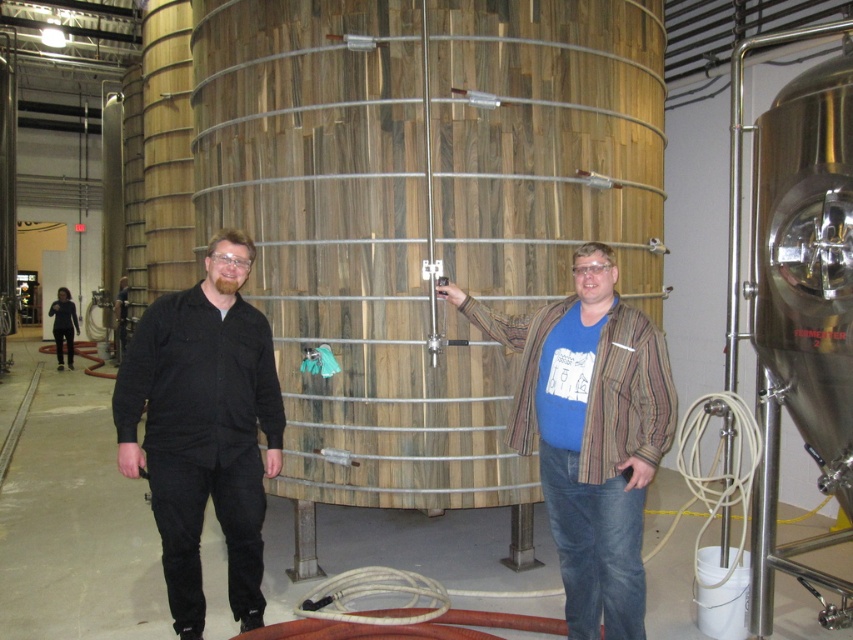
Question: From the image, what is the correct spatial relationship of striped cotton shirt at center in relation to black matte shirt at center?

Choices:
 (A) right
 (B) left

Answer: (A)

Question: Can you confirm if striped cotton shirt at center is smaller than black matte shirt at center?

Choices:
 (A) yes
 (B) no

Answer: (B)

Question: Which point is farther from the camera taking this photo?

Choices:
 (A) (206, 266)
 (B) (608, 460)

Answer: (A)

Question: Can you confirm if striped cotton shirt at center is smaller than black matte shirt at center?

Choices:
 (A) yes
 (B) no

Answer: (B)